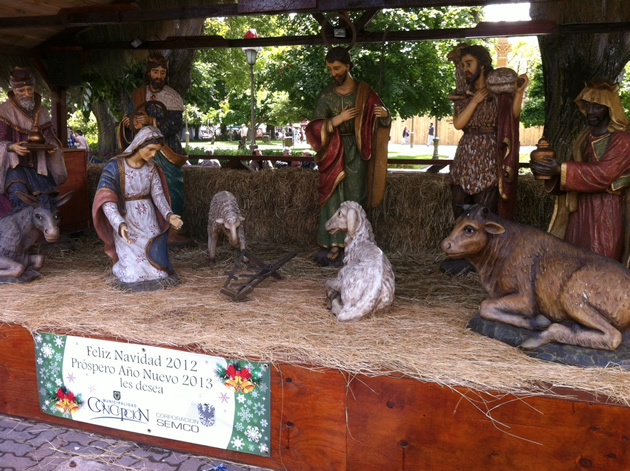
Where is `animal statues`? The width and height of the screenshot is (630, 471). animal statues is located at coordinates (48, 226), (222, 224), (346, 244), (484, 257).